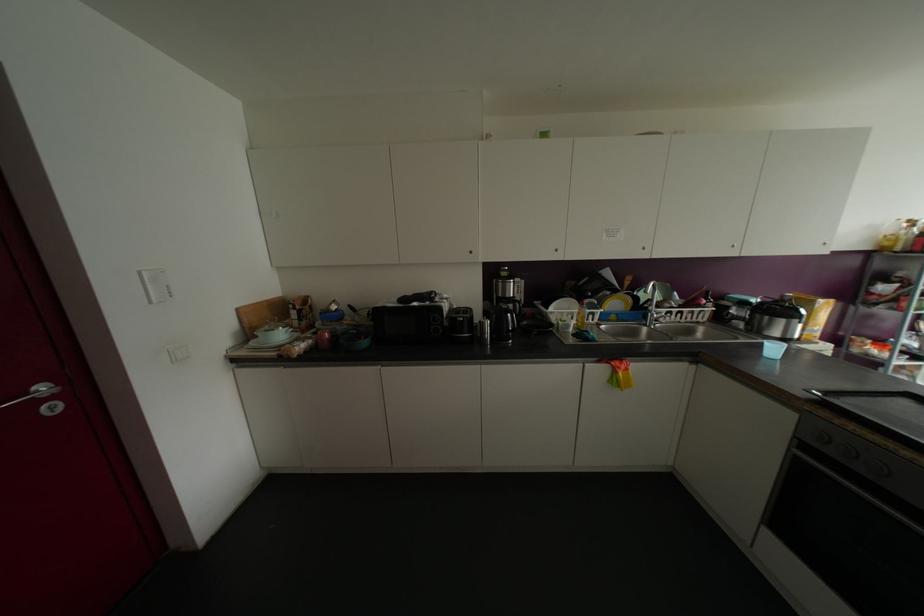
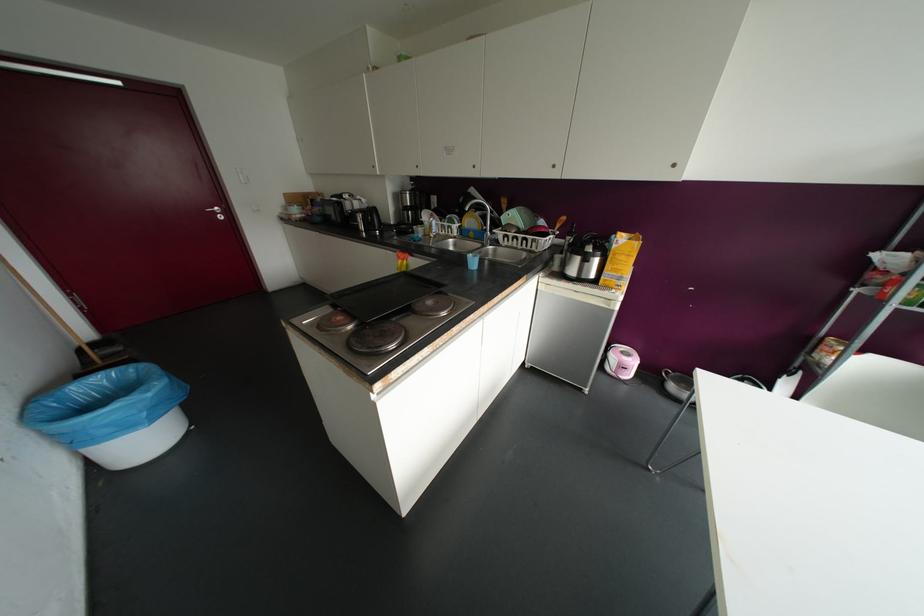
Locate, in the second image, the point that corresponds to (x=614, y=302) in the first image.

(469, 221)